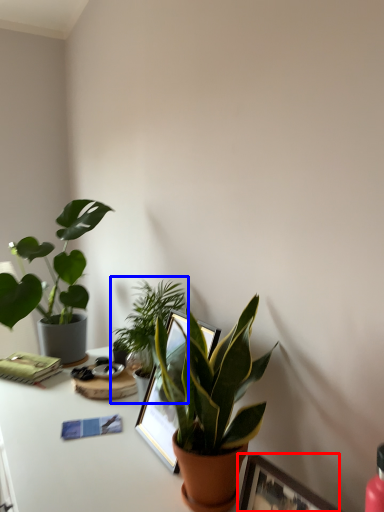
Question: Which of the following is the farthest to the observer, picture frame (highlighted by a red box) or houseplant (highlighted by a blue box)?

Choices:
 (A) picture frame
 (B) houseplant

Answer: (B)